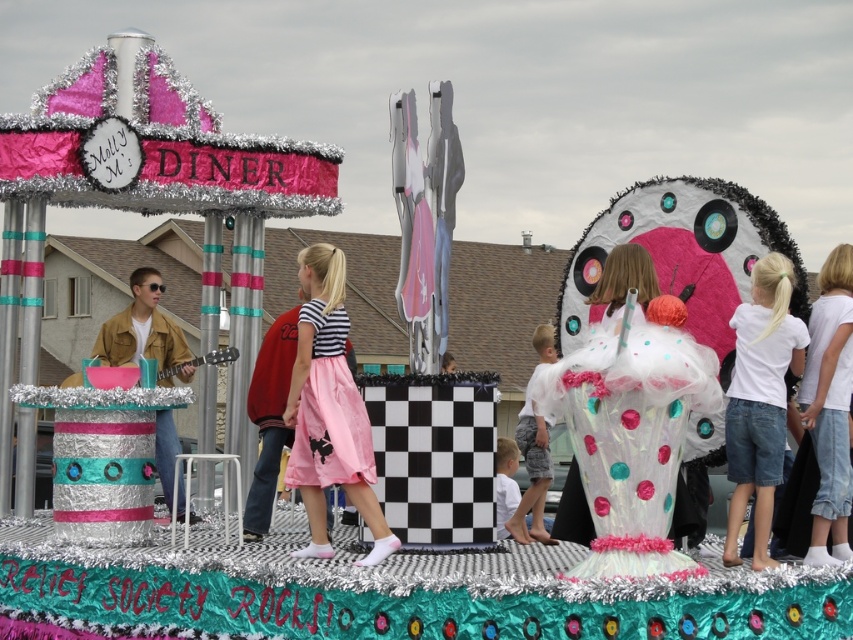
Is pink satin skirt at center smaller than translucent tulle dress at center?

Yes, pink satin skirt at center is smaller than translucent tulle dress at center.

What do you see at coordinates (329, 410) in the screenshot? This screenshot has height=640, width=853. I see `pink satin skirt at center` at bounding box center [329, 410].

Is point (317, 387) behind point (682, 520)?

Yes.

Locate an element on the screen. pink satin skirt at center is located at coordinates (329, 410).

Between point (766, 264) and point (676, 529), which one is positioned behind?

Positioned behind is point (766, 264).

Is white denim shorts at lower right to the right of translucent tulle dress at center from the viewer's perspective?

Correct, you'll find white denim shorts at lower right to the right of translucent tulle dress at center.

Is point (776, 422) farther from camera compared to point (630, 280)?

No, (776, 422) is closer to viewer.

Identify the location of white denim shorts at lower right. This screenshot has height=640, width=853. (759, 400).

Does pink satin skirt at center appear under white cotton shirt at center?

Actually, pink satin skirt at center is above white cotton shirt at center.

Does pink satin skirt at center have a lesser height compared to white cotton shirt at center?

No.

Between point (380, 538) and point (526, 436), which one is positioned behind?

The point (526, 436) is more distant.

The width and height of the screenshot is (853, 640). Identify the location of pink satin skirt at center. (329, 410).